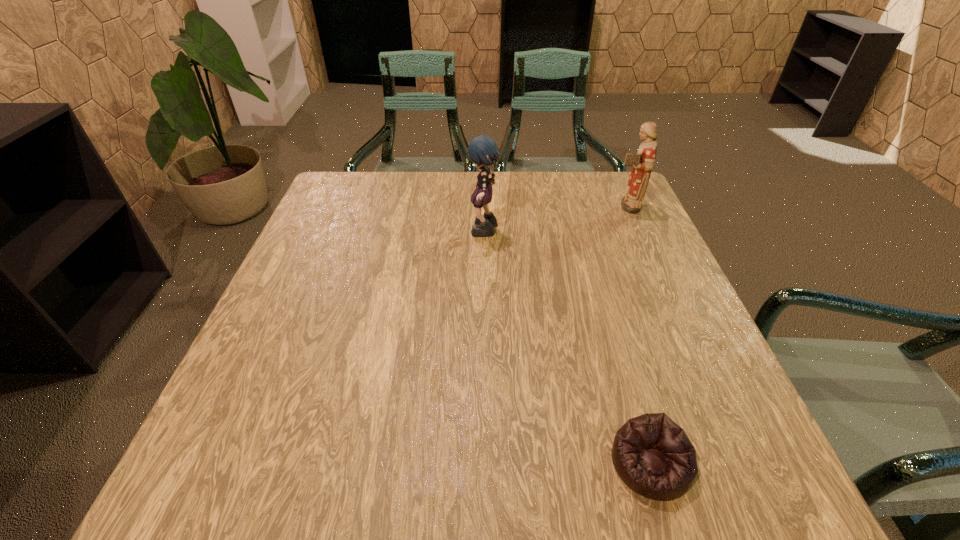
At what (x,y) coordinates should I click in order to perform the action: click on vacant area that satisfies the following two spatial constraints: 1. on the front-facing side of the rightmost object; 2. on the front side of the second object from right to left. Please return your answer as a coordinate pair (x, y). The image size is (960, 540). Looking at the image, I should click on (739, 463).

The width and height of the screenshot is (960, 540). In order to click on vacant space that satisfies the following two spatial constraints: 1. on the front-facing side of the rag doll; 2. on the left side of the beanbag in this screenshot , I will do `click(488, 463)`.

Find the location of `free space that satisfies the following two spatial constraints: 1. on the back side of the second object from left to right; 2. on the front-facing side of the second farthest object`. free space that satisfies the following two spatial constraints: 1. on the back side of the second object from left to right; 2. on the front-facing side of the second farthest object is located at coordinates (583, 232).

You are a GUI agent. You are given a task and a screenshot of the screen. Output one action in this format:
    pyautogui.click(x=<x>, y=<y>)
    Task: Click on the free region that satisfies the following two spatial constraints: 1. on the front-facing side of the leftmost object; 2. on the left side of the shortest object
    Image resolution: width=960 pixels, height=540 pixels.
    Given the screenshot: What is the action you would take?
    pyautogui.click(x=488, y=463)

This screenshot has width=960, height=540. In order to click on vacant space that satisfies the following two spatial constraints: 1. on the front-facing side of the beanbag; 2. on the right side of the rag doll in this screenshot , I will do `click(488, 463)`.